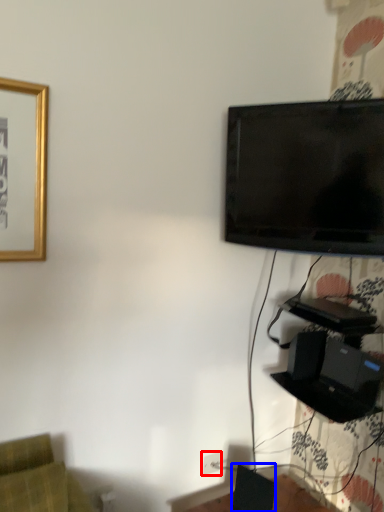
Question: Which object is further to the camera taking this photo, electric outlet (highlighted by a red box) or speaker (highlighted by a blue box)?

Choices:
 (A) electric outlet
 (B) speaker

Answer: (A)